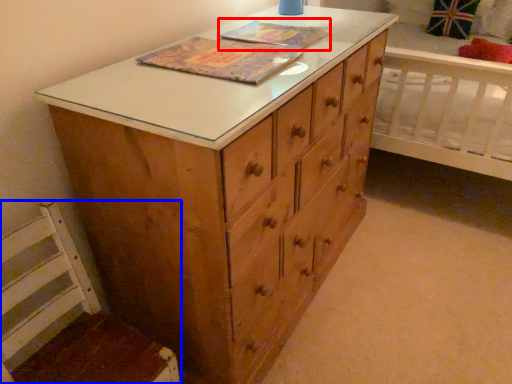
Question: Among these objects, which one is nearest to the camera, book cover (highlighted by a red box) or swivel chair (highlighted by a blue box)?

Choices:
 (A) book cover
 (B) swivel chair

Answer: (B)